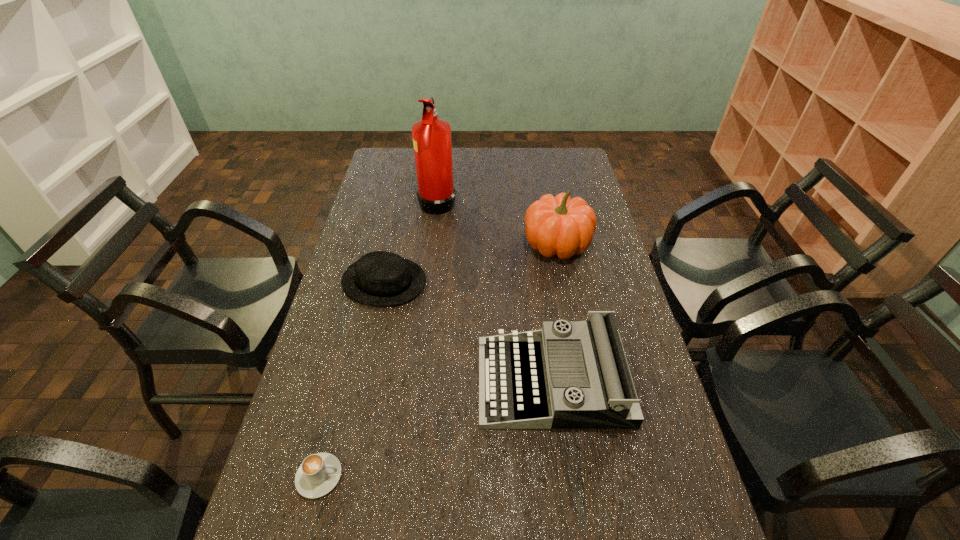
The image size is (960, 540). What are the coordinates of `the farthest object` in the screenshot? It's located at (436, 194).

Find the location of a particular element. The image size is (960, 540). the tallest object is located at coordinates (436, 194).

Locate an element on the screen. the second tallest object is located at coordinates (559, 225).

In order to click on typewriter in this screenshot , I will do `click(569, 375)`.

Identify the location of the fourth farthest object. Image resolution: width=960 pixels, height=540 pixels. (569, 375).

The image size is (960, 540). Identify the location of fedora. (381, 278).

Locate an element on the screen. the shortest object is located at coordinates (318, 474).

Where is `the nearest object`? The height and width of the screenshot is (540, 960). the nearest object is located at coordinates (x=318, y=474).

Locate an element on the screen. This screenshot has height=540, width=960. vacant area located at the spray nozzle of the farthest object is located at coordinates (530, 200).

Locate an element on the screen. The width and height of the screenshot is (960, 540). vacant space situated on the back of the second tallest object is located at coordinates (544, 179).